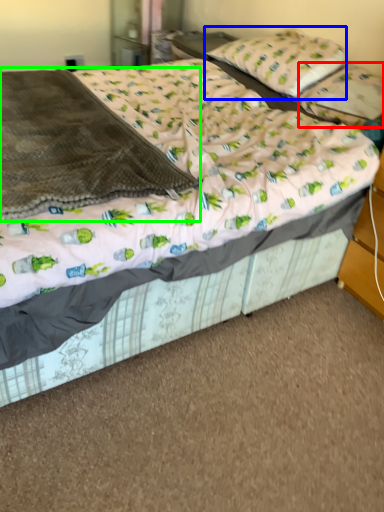
Question: Which object is positioned closest to pillow (highlighted by a red box)? Select from pillow (highlighted by a blue box) and blanket (highlighted by a green box).

Choices:
 (A) pillow
 (B) blanket

Answer: (A)